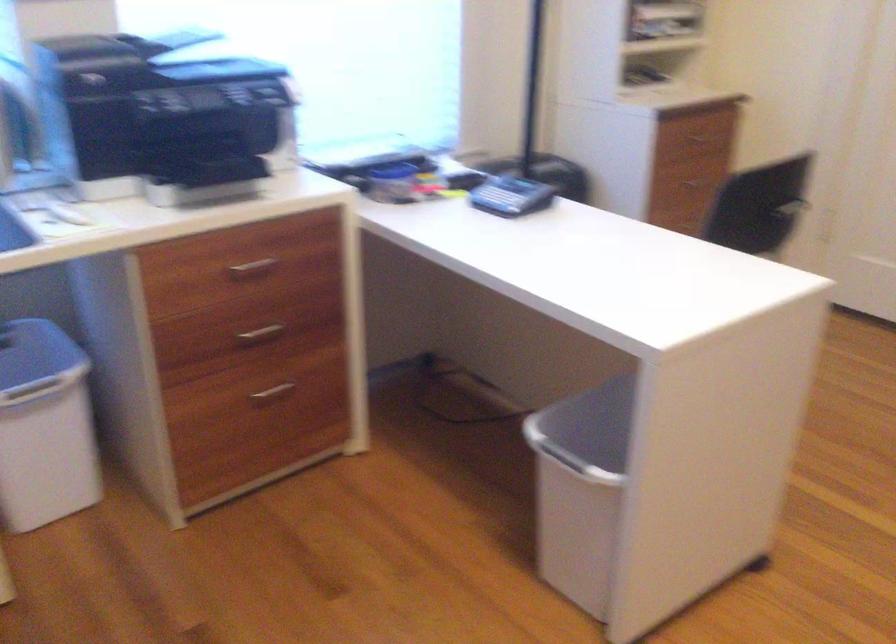
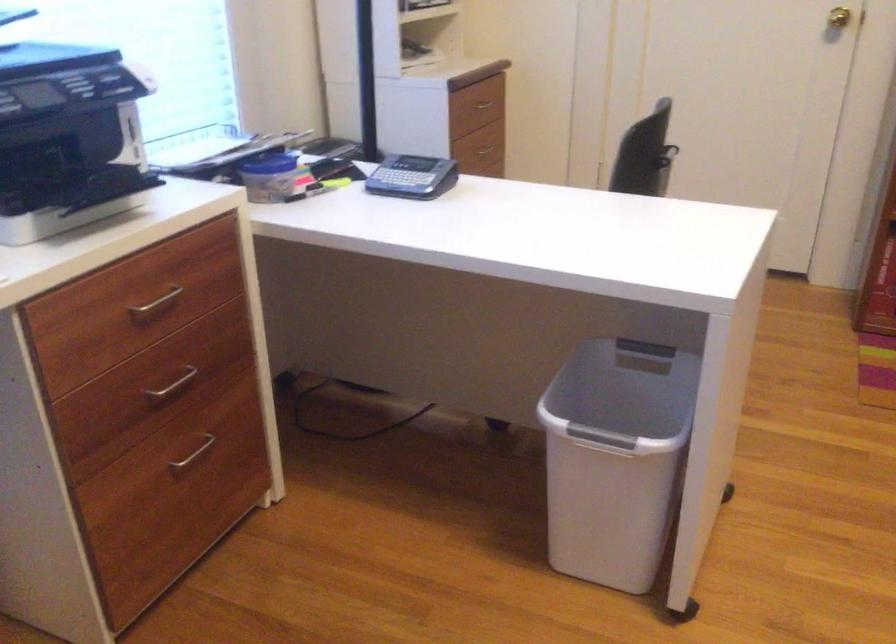
Question: The first image is from the beginning of the video and the second image is from the end. How did the camera likely rotate when shooting the video?

Choices:
 (A) Left
 (B) Right
 (C) Up
 (D) Down

Answer: (B)